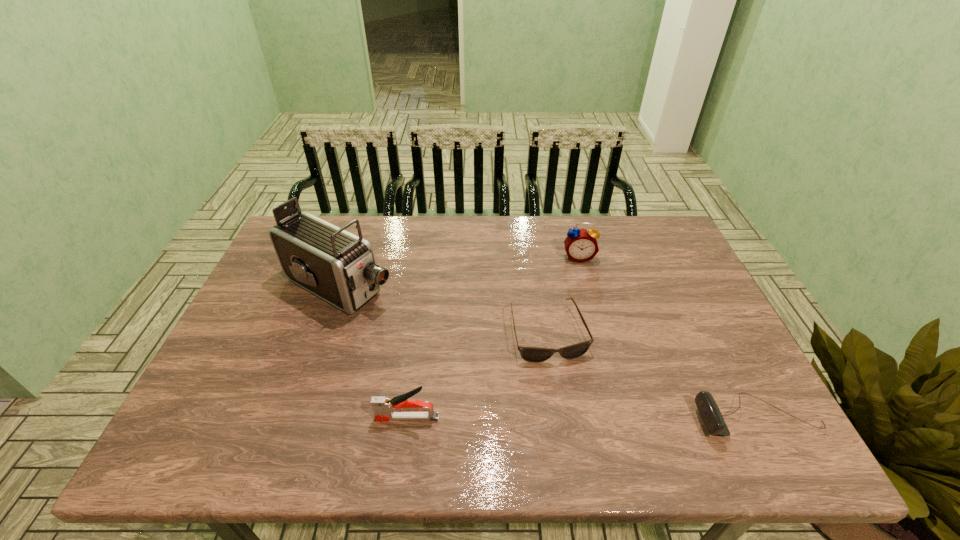
The image size is (960, 540). I want to click on vacant spot on the desktop that is between the third shortest object and the rightmost object and is positioned on the lenses of the shortest object, so click(575, 417).

Find the location of `free space on the desktop that is between the stapler and the webcam and is positioned on the front-facing side of the alarm clock`. free space on the desktop that is between the stapler and the webcam and is positioned on the front-facing side of the alarm clock is located at coordinates (605, 417).

At what (x,y) coordinates should I click in order to perform the action: click on free space on the desktop that is between the third shortest object and the fourth tallest object and is positioned at the lens of the camcorder. Please return your answer as a coordinate pair (x, y). The image size is (960, 540). Looking at the image, I should click on (580, 417).